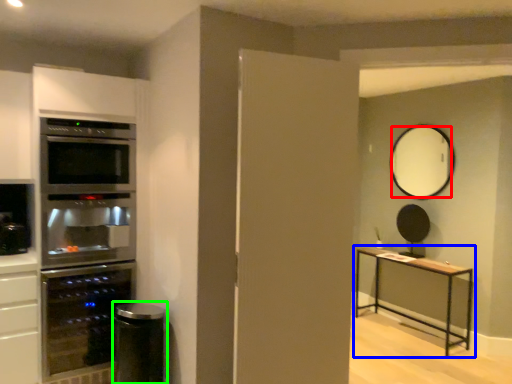
Question: Which is nearer to the mirror (highlighted by a red box)? table (highlighted by a blue box) or appliance (highlighted by a green box).

Choices:
 (A) table
 (B) appliance

Answer: (A)